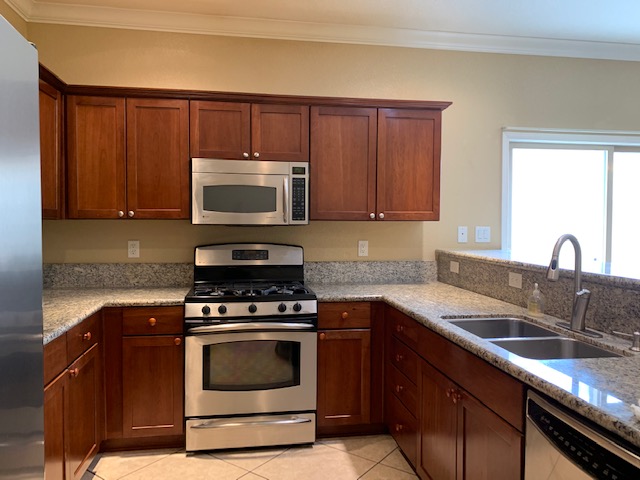
Where is `microwave`? microwave is located at coordinates (232, 200).